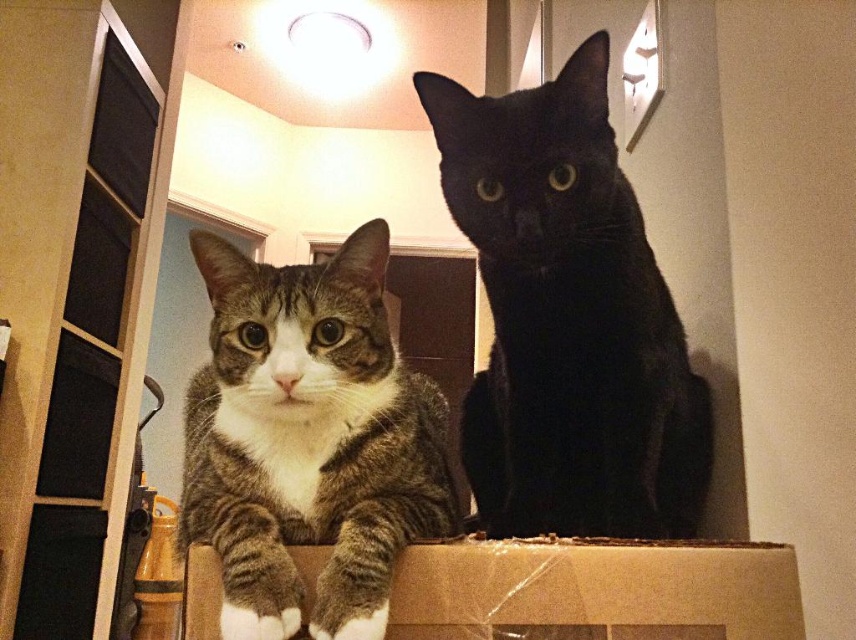
Question: Which object is farther from the camera taking this photo?

Choices:
 (A) black glossy cat at upper center
 (B) tabby fur cat at center
 (C) brown cardboard box at center

Answer: (A)

Question: Does tabby fur cat at center appear over brown cardboard box at center?

Choices:
 (A) yes
 (B) no

Answer: (A)

Question: Is tabby fur cat at center below brown cardboard box at center?

Choices:
 (A) yes
 (B) no

Answer: (B)

Question: Which point is farther to the camera?

Choices:
 (A) black glossy cat at upper center
 (B) tabby fur cat at center

Answer: (A)

Question: Which point is closer to the camera?

Choices:
 (A) tabby fur cat at center
 (B) black glossy cat at upper center
 (C) brown cardboard box at center

Answer: (A)

Question: Is black glossy cat at upper center above tabby fur cat at center?

Choices:
 (A) yes
 (B) no

Answer: (A)